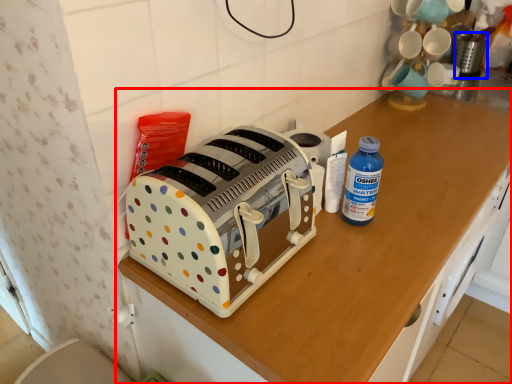
Question: Which object is further to the camera taking this photo, cabinetry (highlighted by a red box) or appliance (highlighted by a blue box)?

Choices:
 (A) cabinetry
 (B) appliance

Answer: (B)